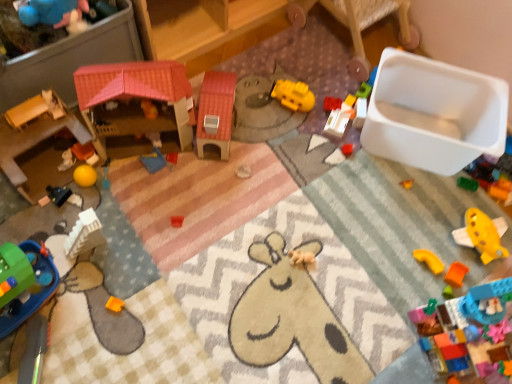
In order to click on vacant space that is to the left of yellow matte plastic toy at center, which is the 8th toy from right to left in this screenshot , I will do `click(252, 97)`.